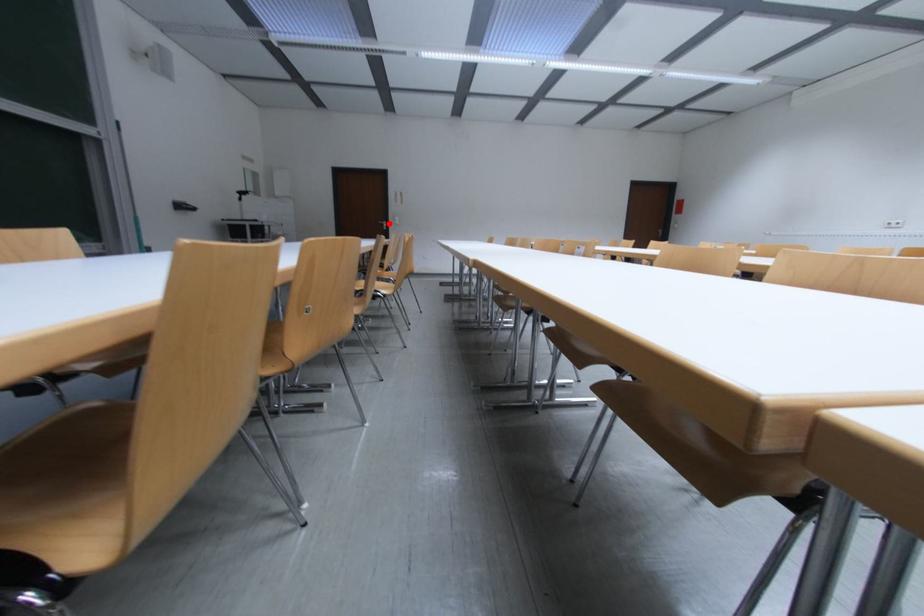
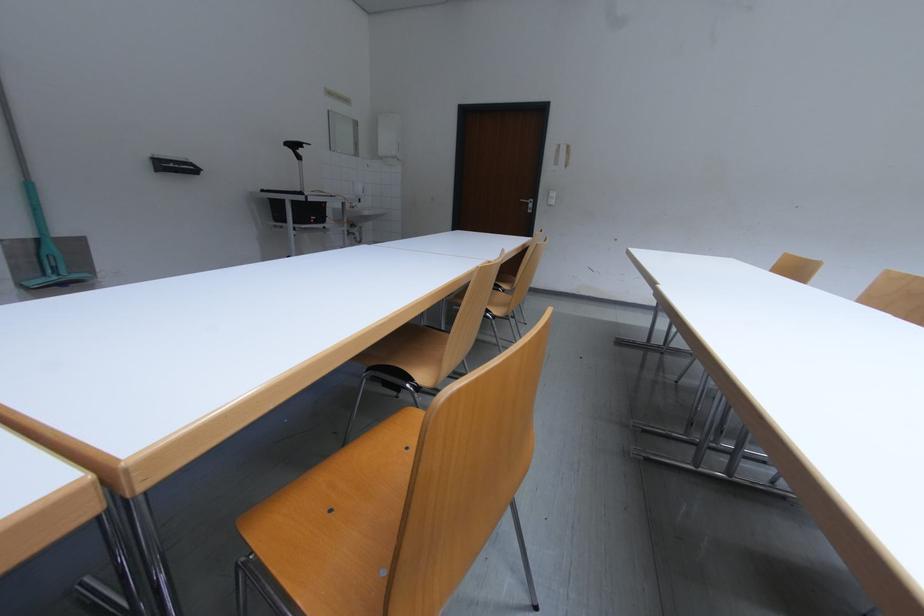
Question: I am providing you with two images of the same scene from different viewpoints. Image1 has a red point marked. In image2, the corresponding 3D location appears at what relative position? Reply with the corresponding letter.

Choices:
 (A) Closer
 (B) Farther

Answer: (B)